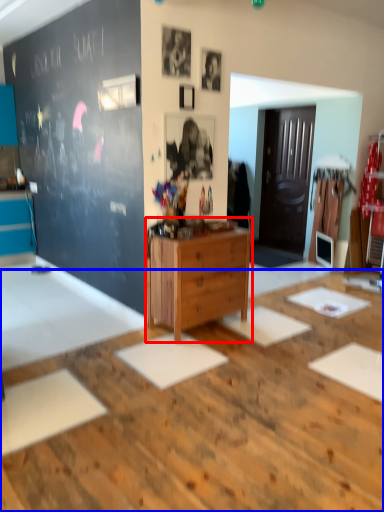
Question: Among these objects, which one is farthest to the camera, chest of drawers (highlighted by a red box) or table (highlighted by a blue box)?

Choices:
 (A) chest of drawers
 (B) table

Answer: (A)